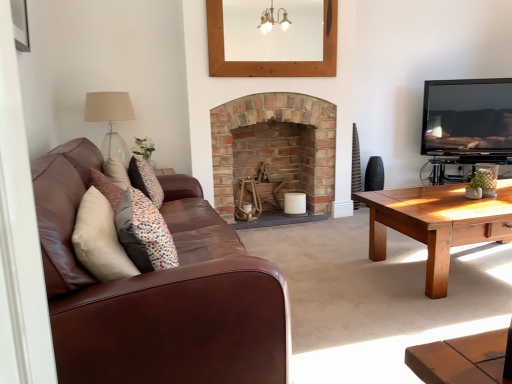
Question: Considering the relative sizes of brown leather couch at left and beige fabric lampshade at upper left in the image provided, is brown leather couch at left thinner than beige fabric lampshade at upper left?

Choices:
 (A) no
 (B) yes

Answer: (A)

Question: Are brown leather couch at left and beige fabric lampshade at upper left located far from each other?

Choices:
 (A) no
 (B) yes

Answer: (B)

Question: Can you see brown leather couch at left touching beige fabric lampshade at upper left?

Choices:
 (A) yes
 (B) no

Answer: (B)

Question: From the image's perspective, is brown leather couch at left beneath beige fabric lampshade at upper left?

Choices:
 (A) no
 (B) yes

Answer: (B)

Question: Considering the relative positions of brown leather couch at left and beige fabric lampshade at upper left in the image provided, is brown leather couch at left to the right of beige fabric lampshade at upper left from the viewer's perspective?

Choices:
 (A) no
 (B) yes

Answer: (B)

Question: Which is correct: brick fireplace at center is inside black glossy tv at upper right, or outside of it?

Choices:
 (A) outside
 (B) inside

Answer: (A)

Question: From the image's perspective, is brick fireplace at center located above or below black glossy tv at upper right?

Choices:
 (A) below
 (B) above

Answer: (A)

Question: Considering the positions of brick fireplace at center and black glossy tv at upper right in the image, is brick fireplace at center bigger or smaller than black glossy tv at upper right?

Choices:
 (A) big
 (B) small

Answer: (A)

Question: Looking at their shapes, would you say brick fireplace at center is wider or thinner than black glossy tv at upper right?

Choices:
 (A) thin
 (B) wide

Answer: (B)

Question: Is brick fireplace at center to the left or to the right of beige fabric lampshade at upper left in the image?

Choices:
 (A) left
 (B) right

Answer: (B)

Question: Considering their positions, is brick fireplace at center located in front of or behind beige fabric lampshade at upper left?

Choices:
 (A) front
 (B) behind

Answer: (B)

Question: Looking at their shapes, would you say brick fireplace at center is wider or thinner than beige fabric lampshade at upper left?

Choices:
 (A) thin
 (B) wide

Answer: (B)

Question: Considering the positions of point (318, 170) and point (84, 110), is point (318, 170) closer or farther from the camera than point (84, 110)?

Choices:
 (A) farther
 (B) closer

Answer: (A)

Question: Is brown leather couch at left in front of or behind multicolored fabric pillow at center in the image?

Choices:
 (A) front
 (B) behind

Answer: (A)

Question: Considering the positions of point (143, 296) and point (177, 254), is point (143, 296) closer or farther from the camera than point (177, 254)?

Choices:
 (A) farther
 (B) closer

Answer: (B)